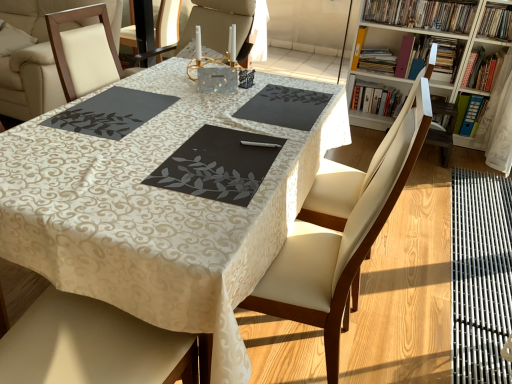
I want to click on free space above black matte place mat at center, which appears as the second place mat when viewed from the right (from a real-world perspective), so click(x=224, y=158).